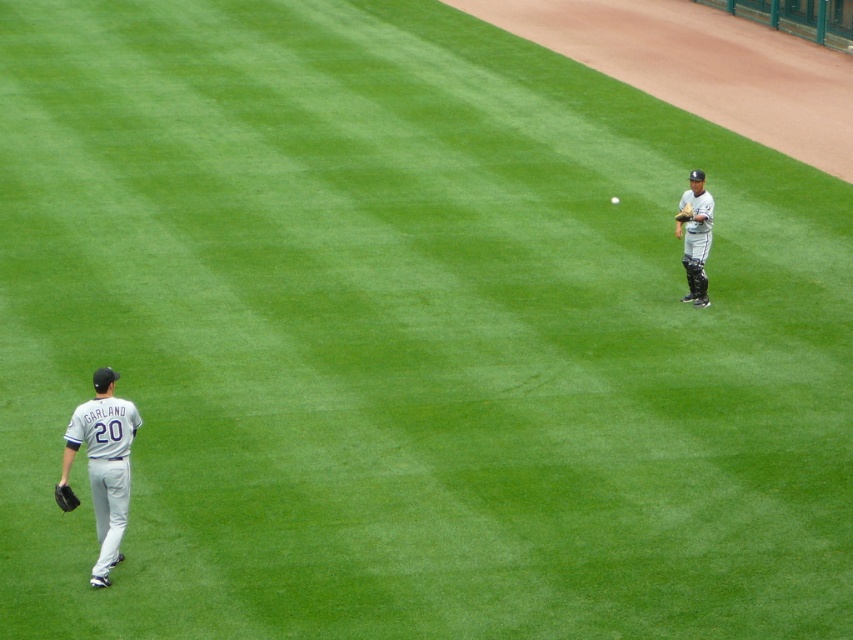
Question: Which point is closer to the camera?

Choices:
 (A) gray fabric uniform at lower left
 (B) gray uniformed catcher at upper right

Answer: (A)

Question: Estimate the real-world distances between objects in this image. Which object is closer to the dark gray leather glove at upper right?

Choices:
 (A) gray uniformed catcher at upper right
 (B) white matte baseball at center
 (C) gray fabric uniform at lower left

Answer: (A)

Question: Does dark gray matte baseball glove at lower left have a larger size compared to white matte baseball at center?

Choices:
 (A) yes
 (B) no

Answer: (A)

Question: Does gray fabric uniform at lower left come behind white matte baseball at center?

Choices:
 (A) no
 (B) yes

Answer: (A)

Question: Does gray uniformed catcher at upper right have a lesser width compared to dark gray leather glove at upper right?

Choices:
 (A) yes
 (B) no

Answer: (B)

Question: Considering the real-world distances, which object is closest to the gray uniformed catcher at upper right?

Choices:
 (A) dark gray matte baseball glove at lower left
 (B) dark gray leather glove at upper right

Answer: (B)